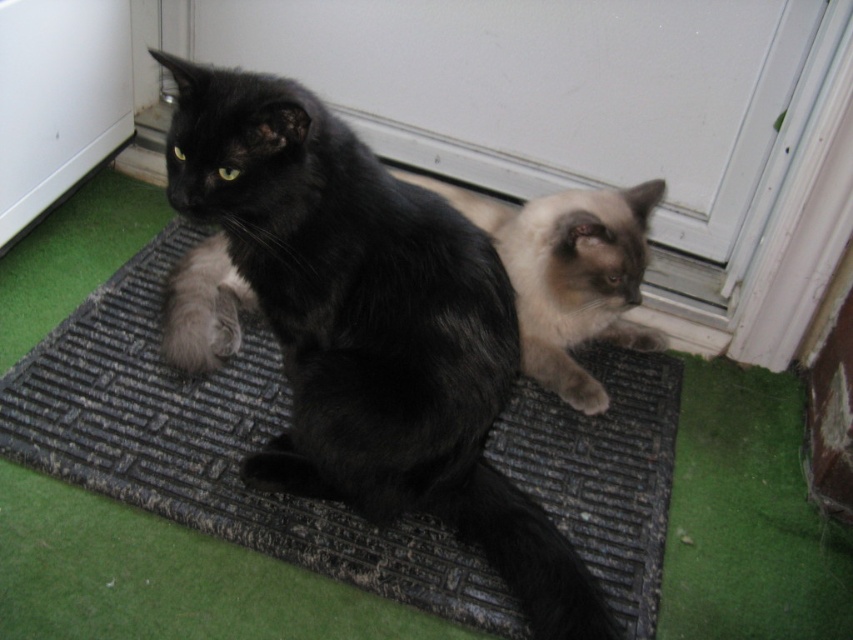
Question: Where is matte black cat at center located in relation to black fur cat at center in the image?

Choices:
 (A) above
 (B) below

Answer: (B)

Question: Is matte black cat at center positioned at the back of black fur cat at center?

Choices:
 (A) yes
 (B) no

Answer: (B)

Question: Which point is closer to the camera?

Choices:
 (A) matte black cat at center
 (B) black fur cat at center

Answer: (A)

Question: Is matte black cat at center further to the viewer compared to black fur cat at center?

Choices:
 (A) no
 (B) yes

Answer: (A)

Question: Which point is closer to the camera taking this photo?

Choices:
 (A) (314, 460)
 (B) (598, 296)

Answer: (A)